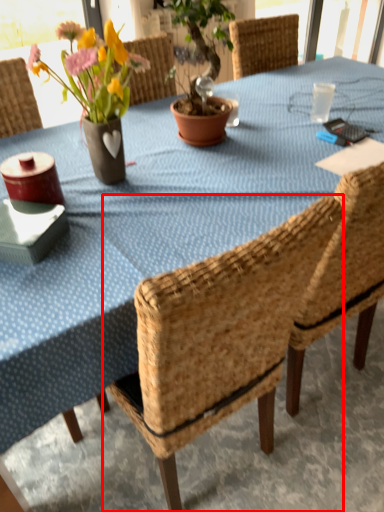
Question: From the image, what is the correct spatial relationship of chair (annotated by the red box) in relation to floral arrangement?

Choices:
 (A) right
 (B) left

Answer: (A)